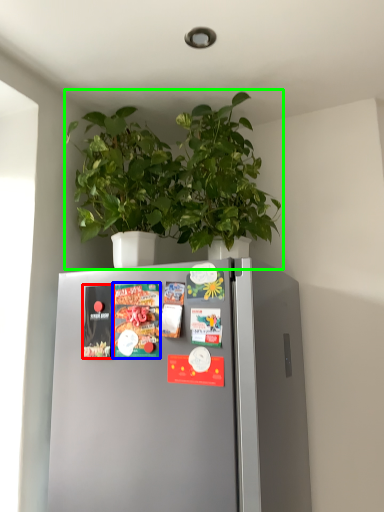
Question: Which object is positioned farthest from magazine (highlighted by a red box)? Select from magazine (highlighted by a blue box) and houseplant (highlighted by a green box).

Choices:
 (A) magazine
 (B) houseplant

Answer: (B)